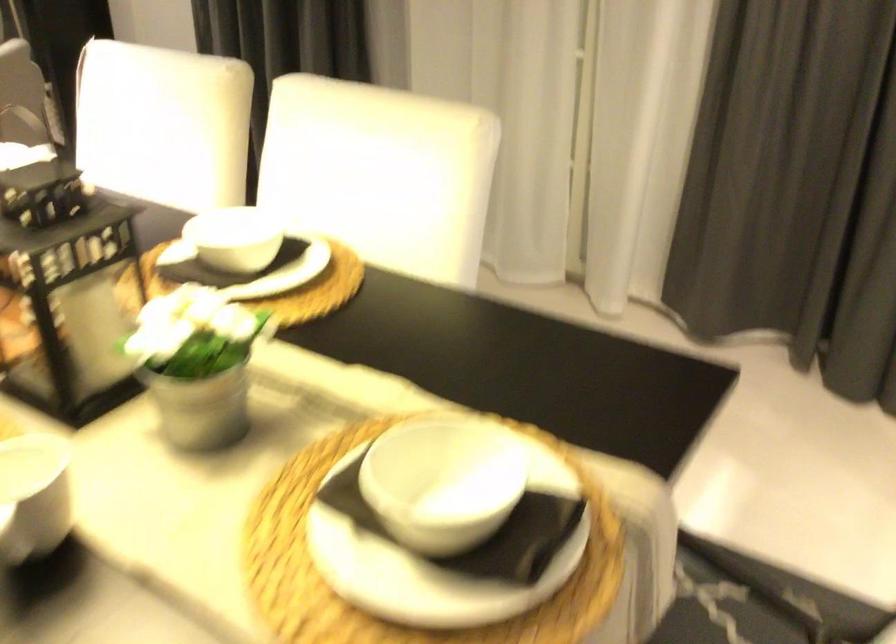
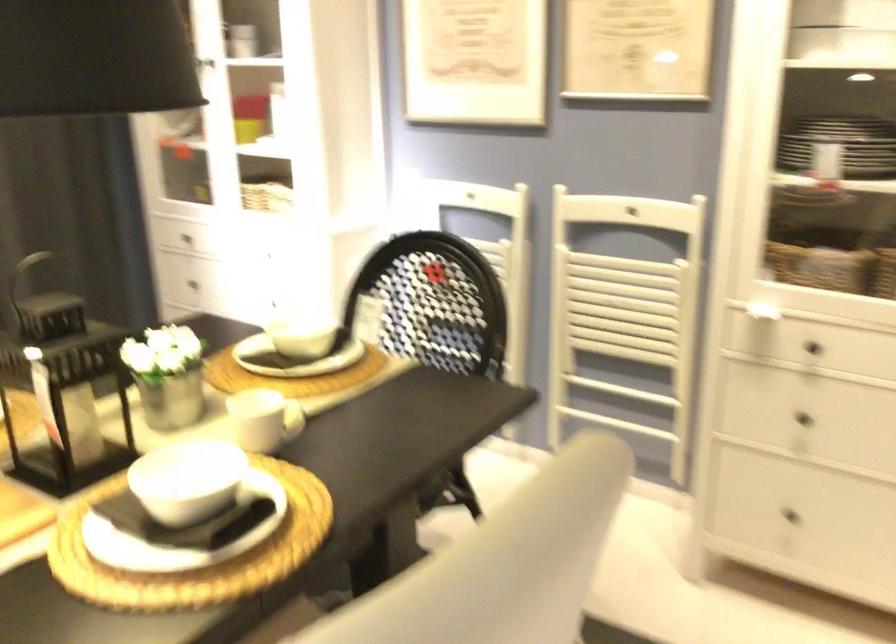
Where in the second image is the point corresponding to pixel 377 488 from the first image?

(306, 337)